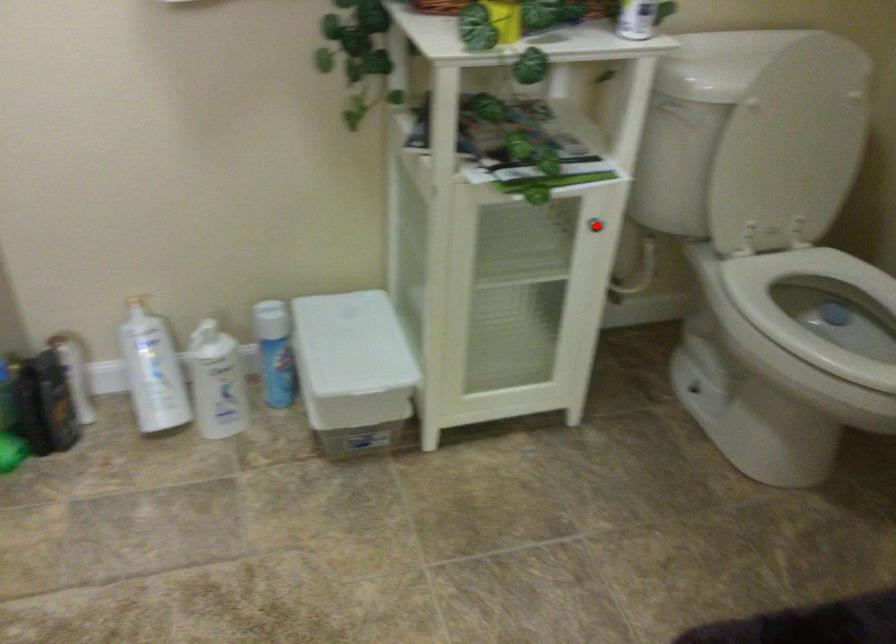
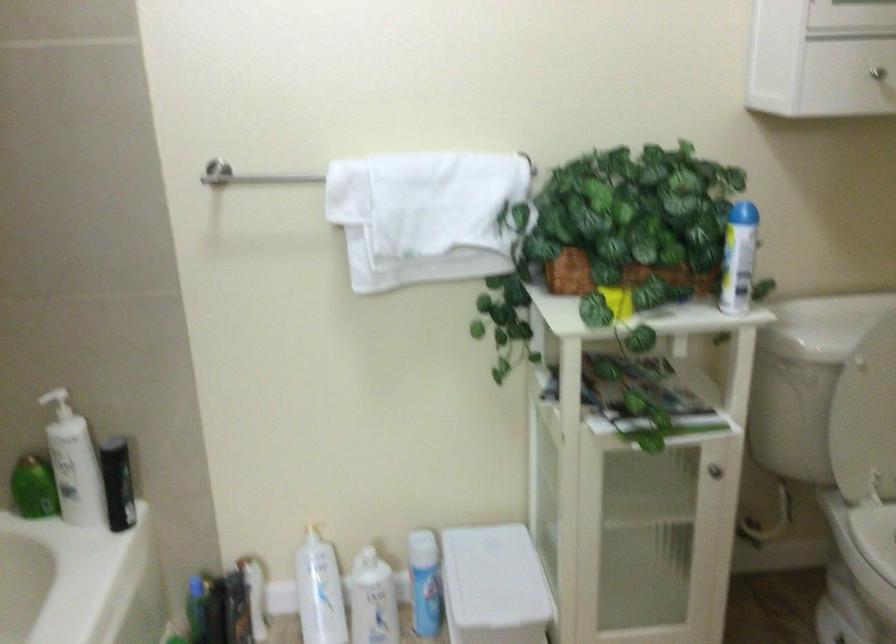
The point at the highlighted location is marked in the first image. Where is the corresponding point in the second image?

(713, 469)